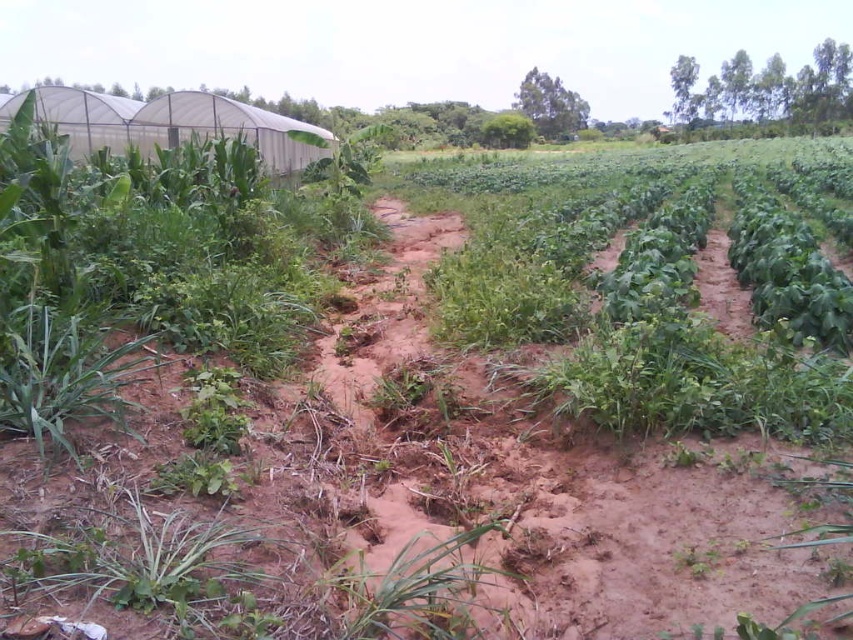
Question: Is green leafy plant at lower left to the right of green grass at center from the viewer's perspective?

Choices:
 (A) yes
 (B) no

Answer: (B)

Question: Which of the following is the closest to the observer?

Choices:
 (A) green leafy plant at lower left
 (B) green grass at center

Answer: (A)

Question: Does green leafy plant at lower left appear over green grass at center?

Choices:
 (A) no
 (B) yes

Answer: (B)

Question: Can you confirm if green leafy plant at lower left is positioned above green grass at center?

Choices:
 (A) yes
 (B) no

Answer: (A)